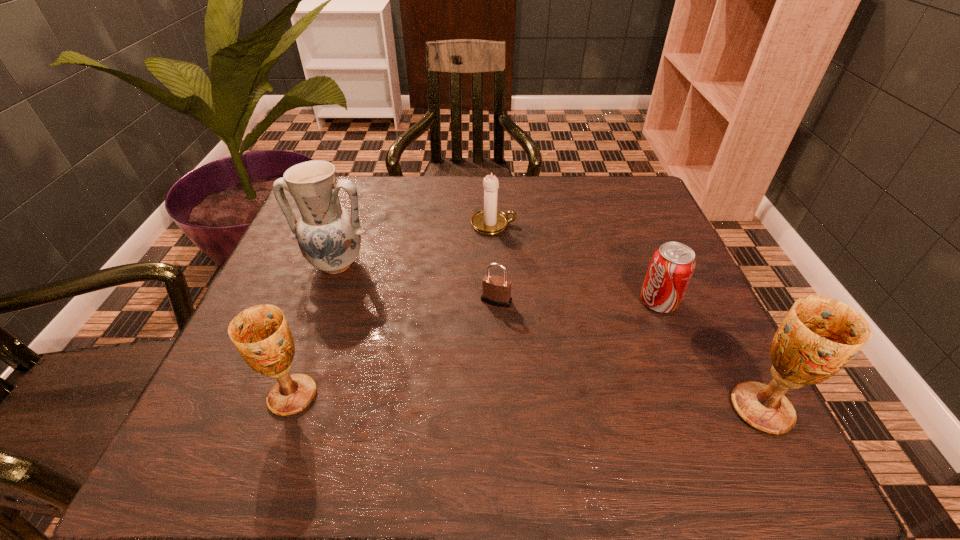
If equal spacing is the goal by inserting an additional chalice among them, please point out a vacant space for this new chalice. Please provide its 2D coordinates. Your answer should be formatted as a tuple, i.e. [(x, y)], where the tuple contains the x and y coordinates of a point satisfying the conditions above.

[(524, 402)]